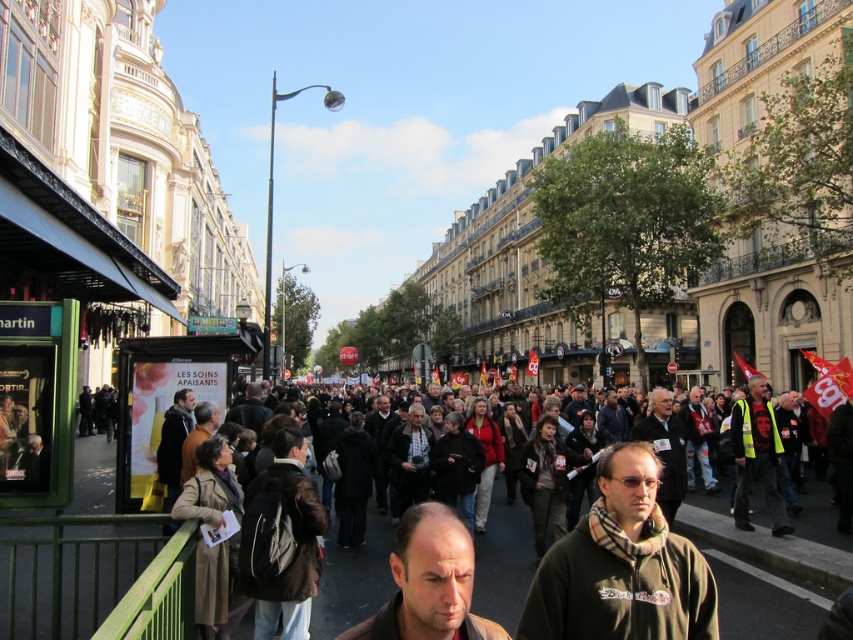
Question: Can you confirm if dark green hoodie at center is positioned above dark brown leather jacket at center?

Choices:
 (A) yes
 (B) no

Answer: (A)

Question: Considering the real-world distances, which object is closest to the brown leather jacket at center?

Choices:
 (A) dark green hoodie at center
 (B) dark brown leather jacket at center

Answer: (A)

Question: Which point is closer to the camera?

Choices:
 (A) dark green hoodie at center
 (B) dark brown leather jacket at center
 (C) brown leather jacket at center

Answer: (C)

Question: Is dark brown leather jacket at center further to the viewer compared to brown leather jacket at center?

Choices:
 (A) no
 (B) yes

Answer: (B)

Question: Which is farther from the brown leather jacket at center?

Choices:
 (A) dark green hoodie at center
 (B) dark brown leather jacket at center

Answer: (B)

Question: Is dark green hoodie at center further to camera compared to brown leather jacket at center?

Choices:
 (A) yes
 (B) no

Answer: (A)